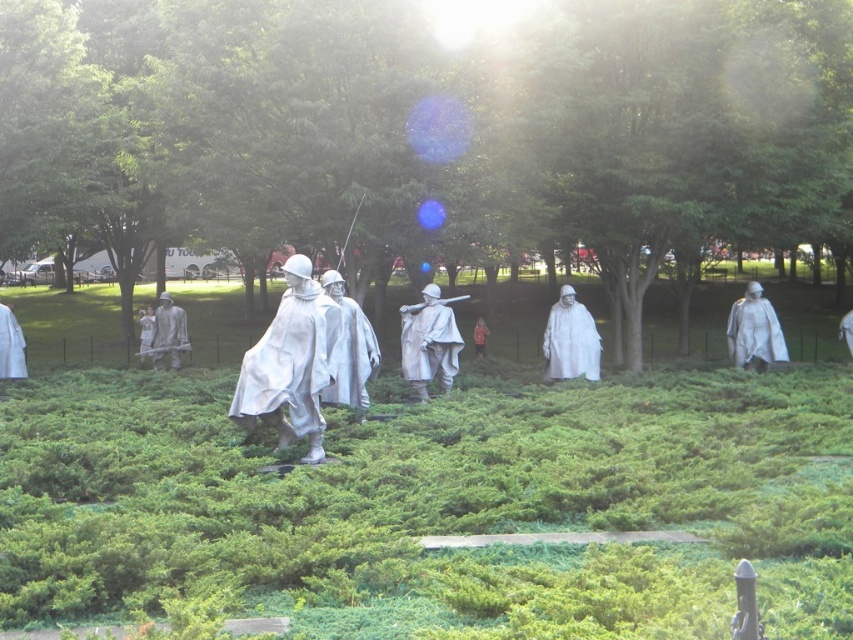
Question: Which object appears farthest from the camera in this image?

Choices:
 (A) matte gray helmet at center
 (B) white metal statues at center

Answer: (A)

Question: Considering the real-world distances, which object is farthest from the polished bronze statue at center?

Choices:
 (A) polished silver statue at center
 (B) white matte statue at center

Answer: (A)

Question: Can you confirm if white glossy statue at center is positioned above matte white helmet at center?

Choices:
 (A) yes
 (B) no

Answer: (B)

Question: Is white matte statue at left behind matte silver helmet at center?

Choices:
 (A) no
 (B) yes

Answer: (A)

Question: Which object is farther from the camera taking this photo?

Choices:
 (A) white matte statue at center
 (B) matte white helmet at center
 (C) white metal statues at center

Answer: (B)

Question: Is white metal statues at center to the left of matte gray helmet at center from the viewer's perspective?

Choices:
 (A) yes
 (B) no

Answer: (B)